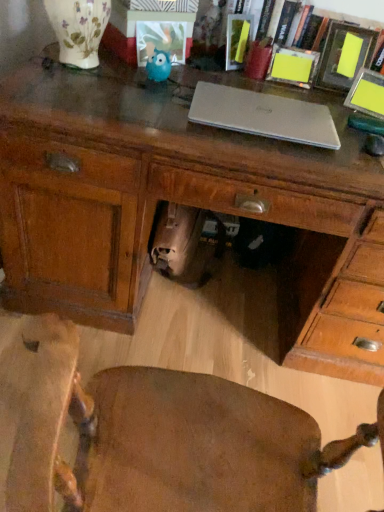
Image resolution: width=384 pixels, height=512 pixels. In order to click on vacant area that is in front of blue fuzzy owl at center in this screenshot , I will do pyautogui.click(x=139, y=97).